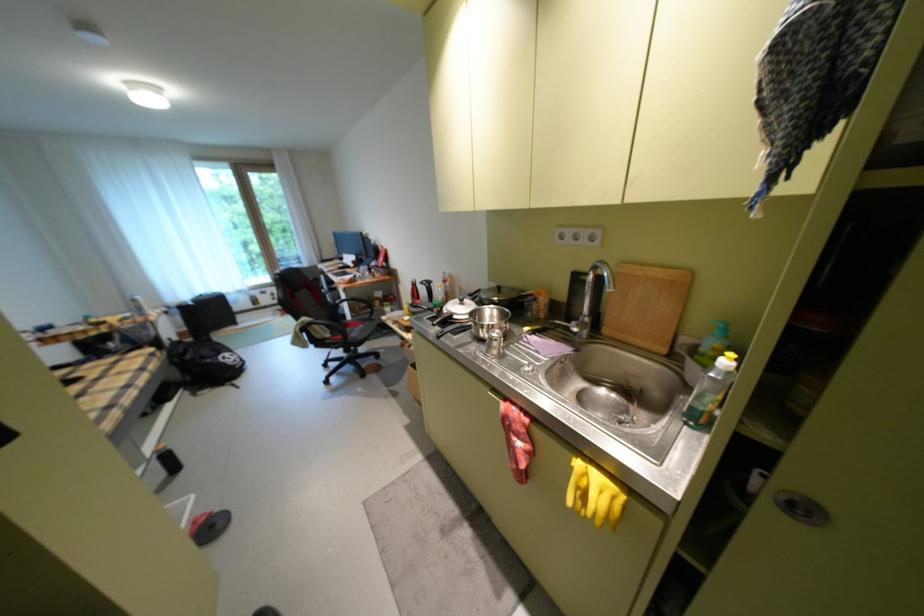
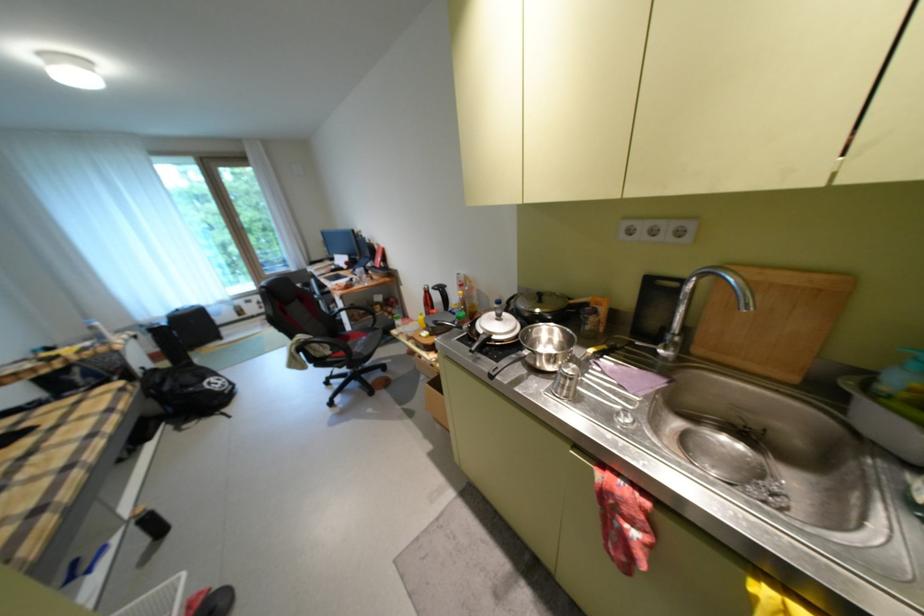
In a continuous first-person perspective shot, in which direction is the camera moving?

The cameraman walked toward left, forward.